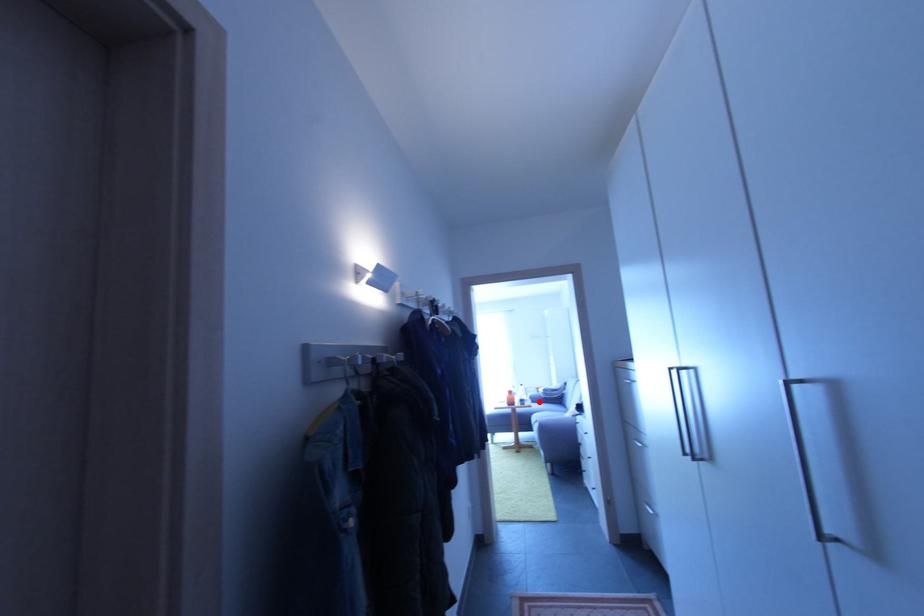
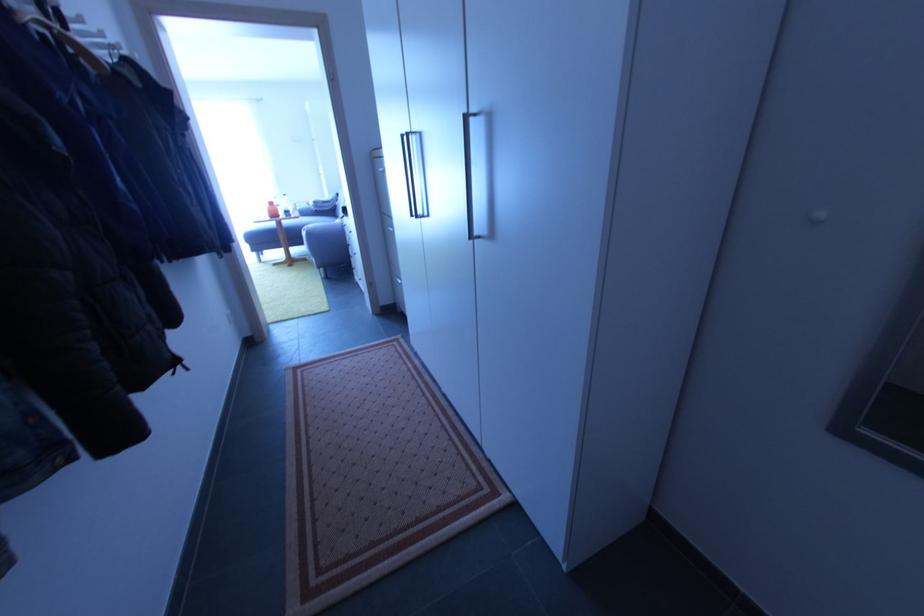
Locate, in the second image, the point that corresponds to the highlighted location in the first image.

(310, 216)